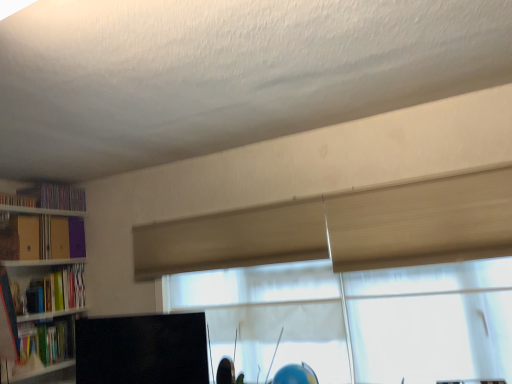
Question: From the image's perspective, is matte plastic bookshelf at left, the fourth book in the bottom-to-top sequence, positioned above or below matte yellow folder at left, the third book from the top?

Choices:
 (A) above
 (B) below

Answer: (A)

Question: From a real-world perspective, is matte plastic bookshelf at left, the fourth book in the bottom-to-top sequence, physically located above or below matte yellow folder at left, arranged as the 3th book when ordered from the bottom?

Choices:
 (A) above
 (B) below

Answer: (A)

Question: Estimate the real-world distances between objects in this image. Which object is closer to the matte plastic bookshelf at left, the fourth book in the bottom-to-top sequence?

Choices:
 (A) wooden bookshelf at left
 (B) translucent wood glass door at upper right
 (C) matte green book at left, which ranks as the 1th book in bottom-to-top order
 (D) translucent fabric window at center
 (E) matte yellow folder at left, the third book from the top

Answer: (E)

Question: Considering the real-world distances, which object is closest to the matte plastic bookshelf at left, the fourth book in the bottom-to-top sequence?

Choices:
 (A) translucent fabric window at center
 (B) black matte computer monitor at lower center
 (C) wooden bookshelf at left
 (D) purple cardboard book at upper left, positioned as the 5th book in bottom-to-top order
 (E) hardcover book at left, which appears as the second book when ordered from the bottom

Answer: (D)